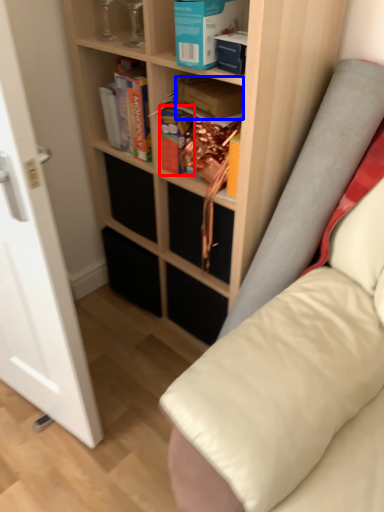
Question: Among these objects, which one is nearest to the camera, paperback book (highlighted by a red box) or paperback book (highlighted by a blue box)?

Choices:
 (A) paperback book
 (B) paperback book

Answer: (B)